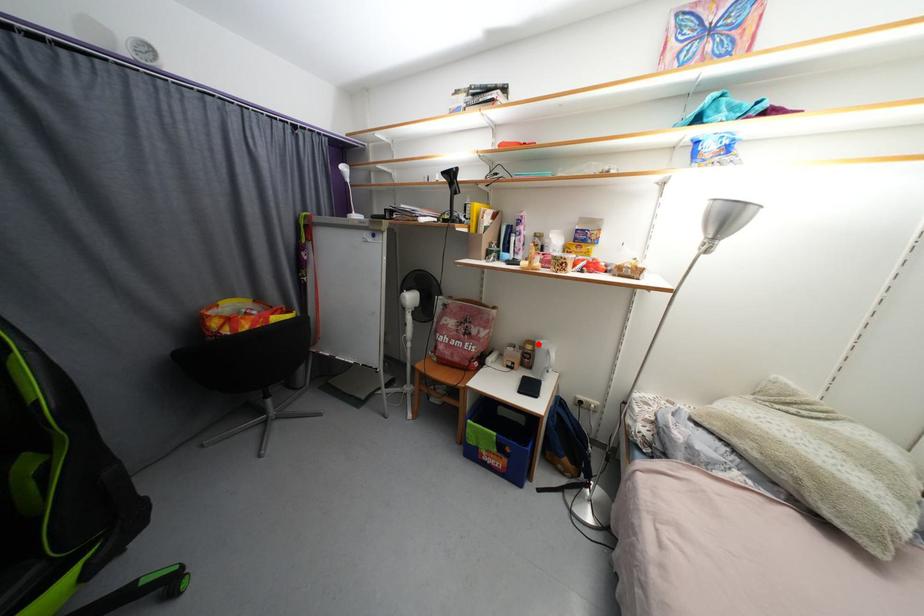
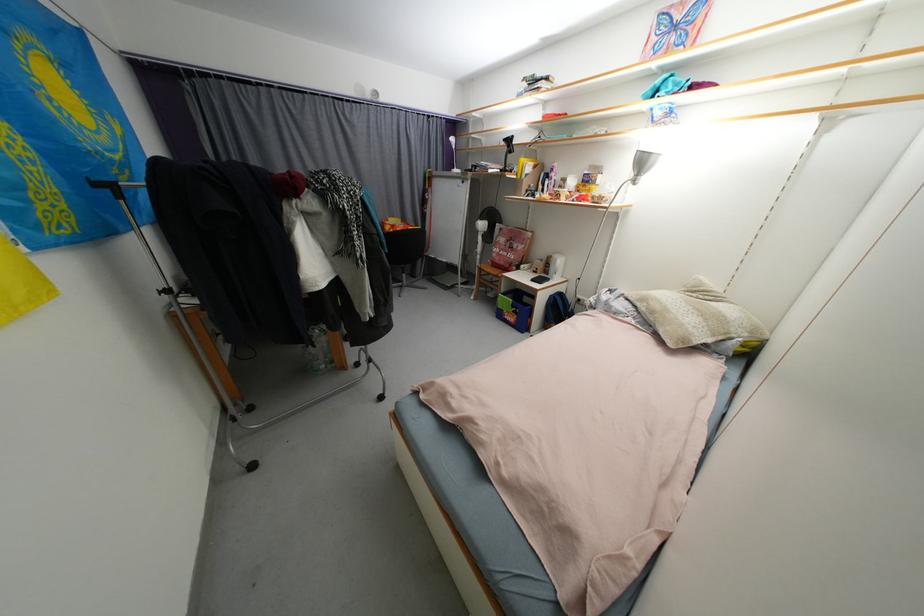
The point at the highlighted location is marked in the first image. Where is the corresponding point in the second image?

(557, 257)